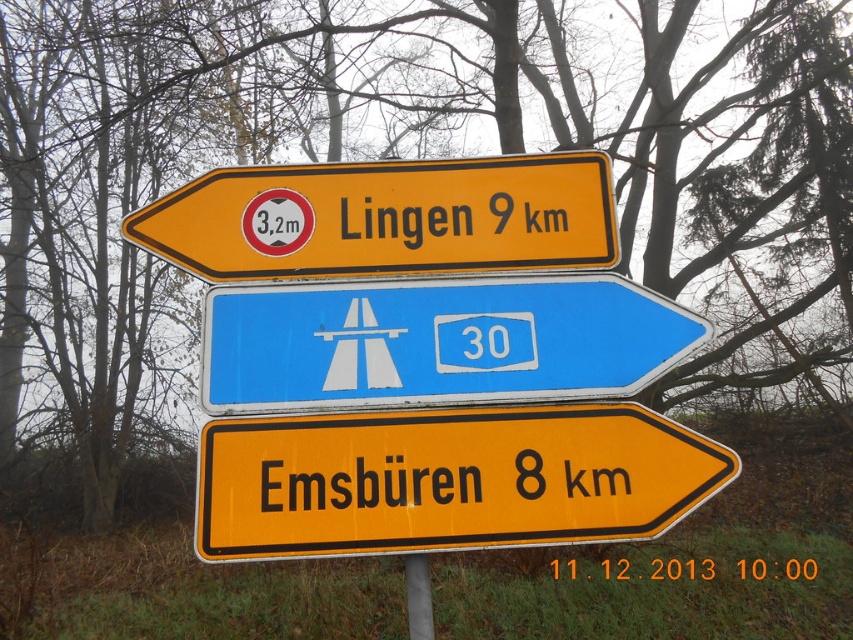
Question: Is blue plastic road sign at center positioned behind metallic pole at center?

Choices:
 (A) yes
 (B) no

Answer: (A)

Question: Among these points, which one is nearest to the camera?

Choices:
 (A) (250, 392)
 (B) (428, 637)

Answer: (B)

Question: Which of the following is the farthest from the observer?

Choices:
 (A) blue plastic road sign at center
 (B) yellow plastic sign at upper center

Answer: (B)

Question: Does yellow plastic sign at lower center appear on the right side of metallic pole at center?

Choices:
 (A) yes
 (B) no

Answer: (A)

Question: Which point is closer to the camera?

Choices:
 (A) [x=424, y=598]
 (B) [x=628, y=289]
 (C) [x=361, y=189]
 (D) [x=412, y=419]

Answer: (D)

Question: Can you confirm if blue plastic road sign at center is smaller than yellow plastic sign at upper center?

Choices:
 (A) yes
 (B) no

Answer: (A)